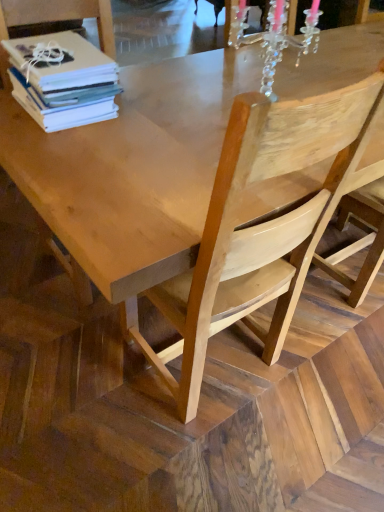
I want to click on natural wood chair at center, so click(x=174, y=405).

Describe the element at coordinates (133, 168) in the screenshot. I see `natural wood table at center` at that location.

Identify the location of natural wood chair at center, which is counted as the 1th chair, starting from the left. The width and height of the screenshot is (384, 512). (59, 16).

The image size is (384, 512). I want to click on clear crystal chandelier at upper center, so click(x=264, y=38).

How many degrees apart are the facing directions of natural wood chair at center, the second chair when ordered from left to right, and clear crystal chandelier at upper center?

The angle between the facing direction of natural wood chair at center, the second chair when ordered from left to right, and the facing direction of clear crystal chandelier at upper center is 4.32 degrees.

From the picture: Between natural wood chair at center, the second chair in the right-to-left sequence, and clear crystal chandelier at upper center, which one appears on the right side from the viewer's perspective?

From the viewer's perspective, clear crystal chandelier at upper center appears more on the right side.

Who is bigger, natural wood chair at center, the second chair when ordered from left to right, or clear crystal chandelier at upper center?

natural wood chair at center, the second chair when ordered from left to right, is bigger.

Can you confirm if natural wood chair at center, the second chair when ordered from left to right, is thinner than clear crystal chandelier at upper center?

Incorrect, the width of natural wood chair at center, the second chair when ordered from left to right, is not less than that of clear crystal chandelier at upper center.

Can you tell me how much clear crystal chandelier at upper center and natural wood table at center differ in facing direction?

clear crystal chandelier at upper center and natural wood table at center are facing 0.787 degrees away from each other.

From a real-world perspective, which is physically below, clear crystal chandelier at upper center or natural wood table at center?

natural wood table at center.

Does clear crystal chandelier at upper center have a greater height compared to natural wood table at center?

In fact, clear crystal chandelier at upper center may be shorter than natural wood table at center.

Is natural wood chair at center, the second chair when ordered from left to right, surrounded by natural wood chair at center?

Definitely not — natural wood chair at center, the second chair when ordered from left to right, is not inside natural wood chair at center.

Considering the relative sizes of natural wood chair at center and natural wood chair at center, the second chair when ordered from left to right, in the image provided, is natural wood chair at center thinner than natural wood chair at center, the second chair when ordered from left to right,?

No.

Is natural wood chair at center in front of or behind natural wood chair at center, the second chair in the right-to-left sequence, in the image?

Visually, natural wood chair at center is located behind natural wood chair at center, the second chair in the right-to-left sequence.

Could you tell me if natural wood chair at center is turned towards natural wood chair at center, the second chair when ordered from left to right?

No, natural wood chair at center does not turn towards natural wood chair at center, the second chair when ordered from left to right.

Is natural wood chair at center, which is counted as the 1th chair, starting from the left, facing towards natural wood table at center?

Yes, natural wood chair at center, which is counted as the 1th chair, starting from the left, is oriented towards natural wood table at center.

From a real-world perspective, is natural wood chair at center, which is counted as the 1th chair, starting from the left, below natural wood table at center?

No, from a real-world perspective, natural wood chair at center, which is counted as the 1th chair, starting from the left, is not below natural wood table at center.

From the picture: Which of these two, natural wood chair at center, positioned as the 3th chair in right-to-left order, or natural wood table at center, stands shorter?

With less height is natural wood table at center.

Starting from the natural wood chair at right, which is the 1th chair from right to left, which chair is the 1st one in front? Please provide its 2D coordinates.

[(59, 16)]

From a real-world perspective, is natural wood chair at right, which is the 1th chair from right to left, physically above natural wood chair at center, which is counted as the 1th chair, starting from the left?

No.

Is natural wood chair at right, which ranks as the 3th chair in left-to-right order, far away from natural wood chair at center, which is counted as the 1th chair, starting from the left?

Indeed, natural wood chair at right, which ranks as the 3th chair in left-to-right order, is not near natural wood chair at center, which is counted as the 1th chair, starting from the left.

Consider the image. Do you think natural wood chair at right, which ranks as the 3th chair in left-to-right order, is within natural wood chair at center, positioned as the 3th chair in right-to-left order, or outside of it?

The correct answer is: outside.

Based on the photo, is natural wood chair at center, which is counted as the 1th chair, starting from the left, not near natural wood chair at center?

Yes, natural wood chair at center, which is counted as the 1th chair, starting from the left, and natural wood chair at center are quite far apart.

Which of these two, natural wood chair at center, which is counted as the 1th chair, starting from the left, or natural wood chair at center, stands shorter?

With less height is natural wood chair at center.

Which is correct: natural wood chair at center, which is counted as the 1th chair, starting from the left, is inside natural wood chair at center, or outside of it?

natural wood chair at center, which is counted as the 1th chair, starting from the left, is not enclosed by natural wood chair at center.

Does natural wood chair at right, which ranks as the 3th chair in left-to-right order, turn towards natural wood chair at center?

Yes, natural wood chair at right, which ranks as the 3th chair in left-to-right order, is turned towards natural wood chair at center.

Which of these two, natural wood chair at right, which ranks as the 3th chair in left-to-right order, or natural wood chair at center, is wider?

natural wood chair at center is wider.

From the picture: From a real-world perspective, is natural wood chair at right, which ranks as the 3th chair in left-to-right order, positioned above or below natural wood chair at center?

natural wood chair at right, which ranks as the 3th chair in left-to-right order, is situated higher than natural wood chair at center in the real world.

Locate an element on the screen. candle holder located on the right of natural wood chair at center, the second chair when ordered from left to right is located at coordinates (264, 38).

This screenshot has width=384, height=512. What are the coordinates of `round table that appears below the clear crystal chandelier at upper center (from a real-world perspective)` in the screenshot? It's located at (133, 168).

Which object lies further to the anchor point natural wood chair at center, natural wood chair at center, the second chair when ordered from left to right, or white paper stack at upper left?

Among the two, white paper stack at upper left is located further to natural wood chair at center.

Based on the photo, from the image, which object appears to be nearer to natural wood chair at center, clear crystal chandelier at upper center or natural wood chair at center, the second chair in the right-to-left sequence?

natural wood chair at center, the second chair in the right-to-left sequence, is closer to natural wood chair at center.

When comparing their distances from white paper stack at upper left, does clear crystal chandelier at upper center or natural wood chair at center, the second chair when ordered from left to right, seem closer?

Based on the image, clear crystal chandelier at upper center appears to be nearer to white paper stack at upper left.

Looking at the image, which one is located further to natural wood chair at center, the second chair in the right-to-left sequence, natural wood chair at center, which is counted as the 1th chair, starting from the left, or clear crystal chandelier at upper center?

natural wood chair at center, which is counted as the 1th chair, starting from the left, is positioned further to the anchor natural wood chair at center, the second chair in the right-to-left sequence.

Looking at the image, which one is located closer to natural wood chair at center, positioned as the 3th chair in right-to-left order, natural wood chair at center, the second chair when ordered from left to right, or natural wood chair at center?

natural wood chair at center, the second chair when ordered from left to right, lies closer to natural wood chair at center, positioned as the 3th chair in right-to-left order, than the other object.

Which object lies nearer to the anchor point natural wood chair at center, positioned as the 3th chair in right-to-left order, natural wood chair at center, the second chair in the right-to-left sequence, or white paper stack at upper left?

white paper stack at upper left is closer to natural wood chair at center, positioned as the 3th chair in right-to-left order.

Considering their positions, is natural wood chair at center, the second chair when ordered from left to right, positioned further to natural wood chair at right, which ranks as the 3th chair in left-to-right order, than white paper stack at upper left?

white paper stack at upper left.

Estimate the real-world distances between objects in this image. Which object is further from clear crystal chandelier at upper center, natural wood chair at right, which ranks as the 3th chair in left-to-right order, or white paper stack at upper left?

natural wood chair at right, which ranks as the 3th chair in left-to-right order, is further to clear crystal chandelier at upper center.

Identify the location of round table between natural wood chair at center, positioned as the 3th chair in right-to-left order, and natural wood chair at right, which is the 1th chair from right to left, from left to right. (133, 168).

Locate an element on the screen. round table that lies between clear crystal chandelier at upper center and natural wood chair at center, the second chair when ordered from left to right, from top to bottom is located at coordinates (133, 168).

In order to click on candle holder between natural wood chair at center, the second chair when ordered from left to right, and natural wood chair at right, which is the 1th chair from right to left, from left to right in this screenshot , I will do `click(264, 38)`.

The width and height of the screenshot is (384, 512). In order to click on candle holder between natural wood chair at center and natural wood table at center from top to bottom in this screenshot , I will do `click(264, 38)`.